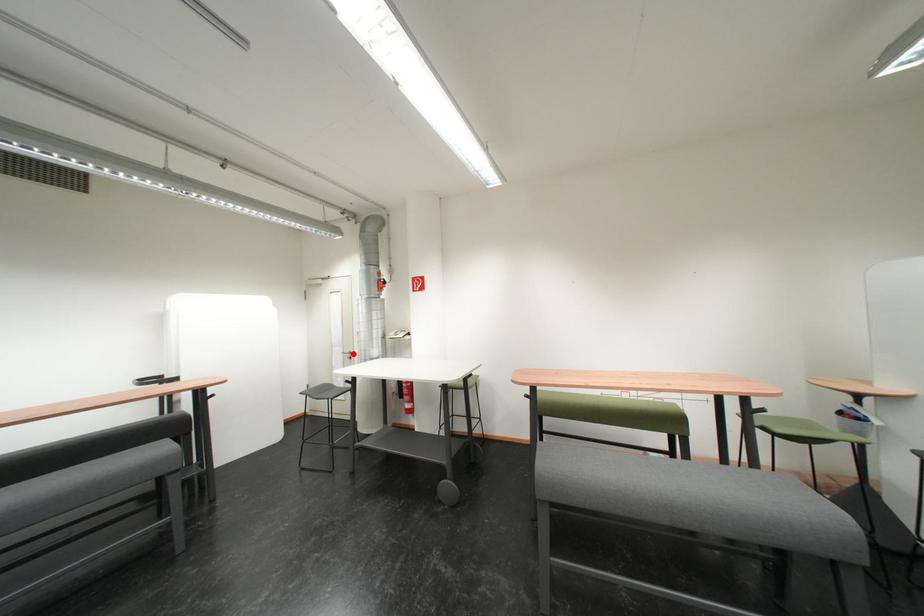
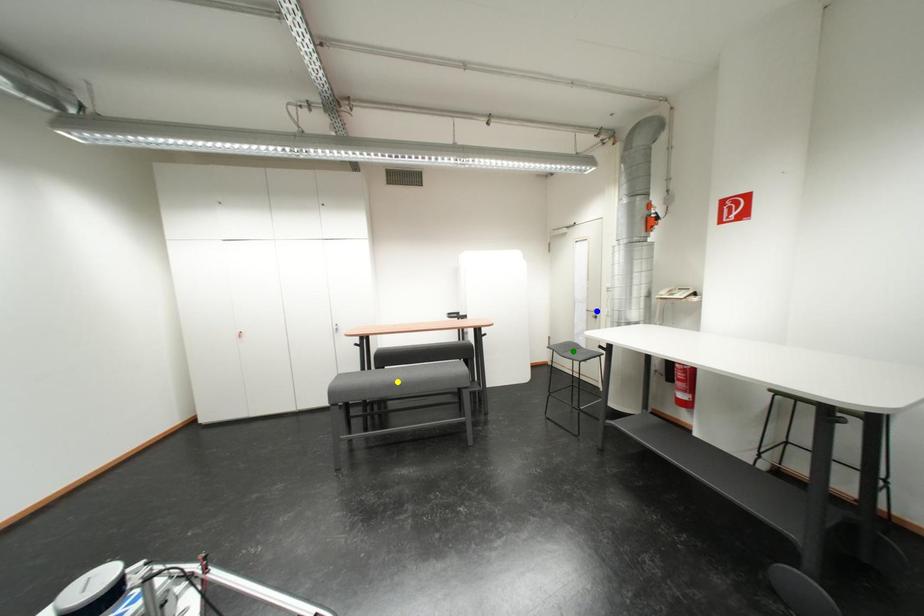
Question: I am providing you with two images of the same scene from different viewpoints. A red point is marked on the first image. You are given multiple points on the second image. Which mark in image 2 goes with the point in image 1?

Choices:
 (A) blue point
 (B) yellow point
 (C) green point

Answer: (A)